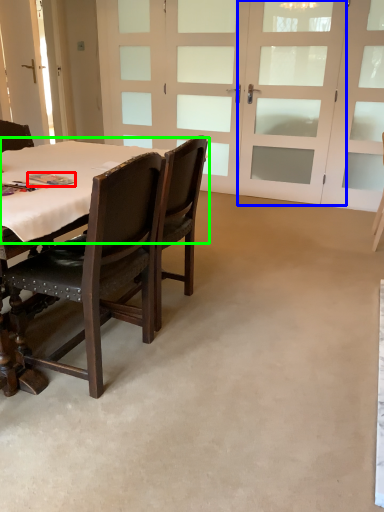
Question: Based on their relative distances, which object is nearer to book (highlighted by a red box)? Choose from screen door (highlighted by a blue box) and table top (highlighted by a green box).

Choices:
 (A) screen door
 (B) table top

Answer: (B)